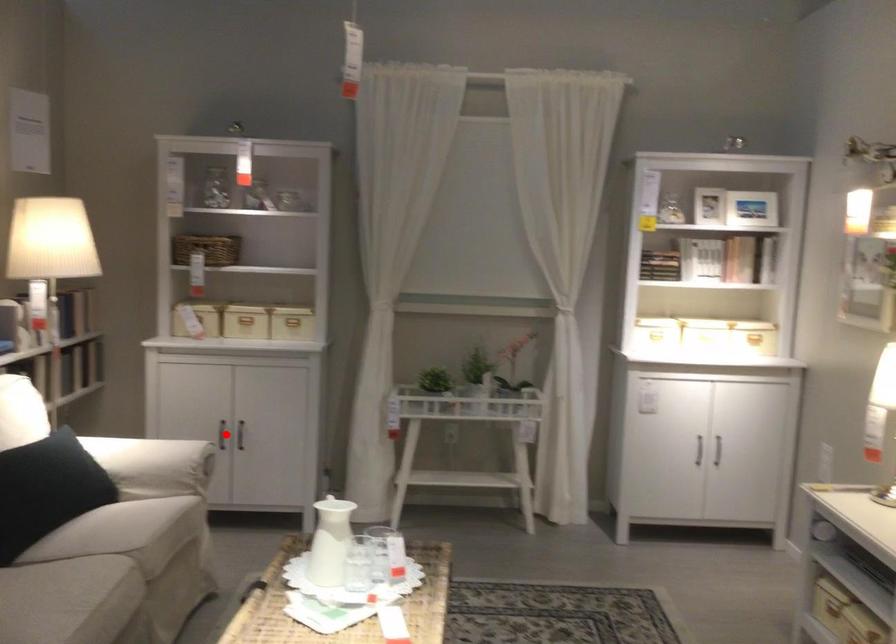
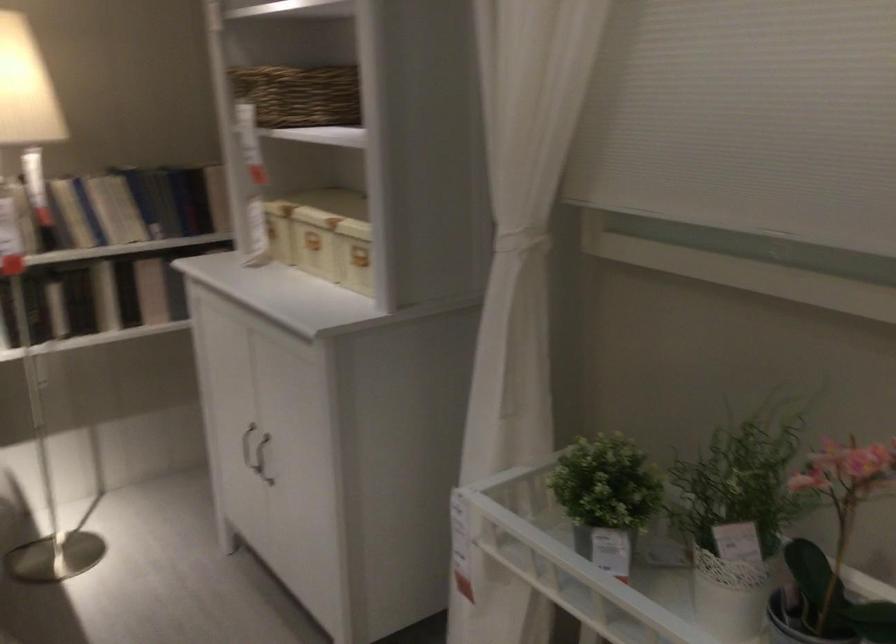
Question: I am providing you with two images of the same scene from different viewpoints. A red point is shown in image1. For the corresponding object point in image2, is it positioned nearer or farther from the camera?

Choices:
 (A) Nearer
 (B) Farther

Answer: (A)